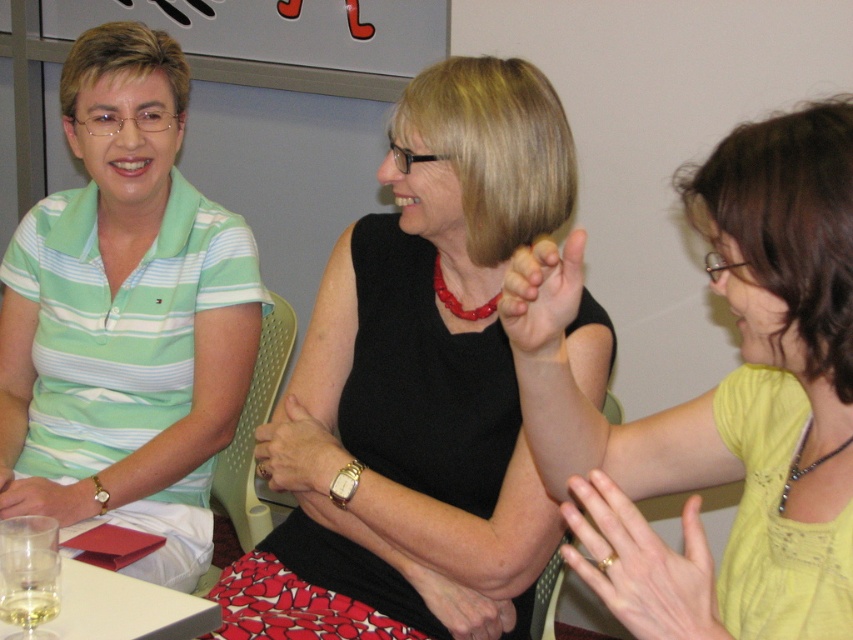
Is the position of clear glass wine glass at lower left more distant than that of smooth skin hand at center?

No, clear glass wine glass at lower left is in front of smooth skin hand at center.

Is clear glass wine glass at lower left to the left of smooth skin hand at center from the viewer's perspective?

Indeed, clear glass wine glass at lower left is positioned on the left side of smooth skin hand at center.

Describe the element at coordinates (28, 573) in the screenshot. I see `clear glass wine glass at lower left` at that location.

The image size is (853, 640). I want to click on clear glass wine glass at lower left, so click(28, 573).

Does yellow matte shirt at upper right have a greater height compared to gold metallic ring at upper right?

Yes.

Does point (556, 385) come behind point (676, 618)?

Yes, point (556, 385) is behind point (676, 618).

The image size is (853, 640). In order to click on yellow matte shirt at upper right in this screenshot , I will do `click(718, 401)`.

Is gold metallic ring at upper right smaller than clear glass wine glass at lower left?

No, gold metallic ring at upper right is not smaller than clear glass wine glass at lower left.

Measure the distance between gold metallic ring at upper right and camera.

31.15 inches

Identify the location of gold metallic ring at upper right. (641, 563).